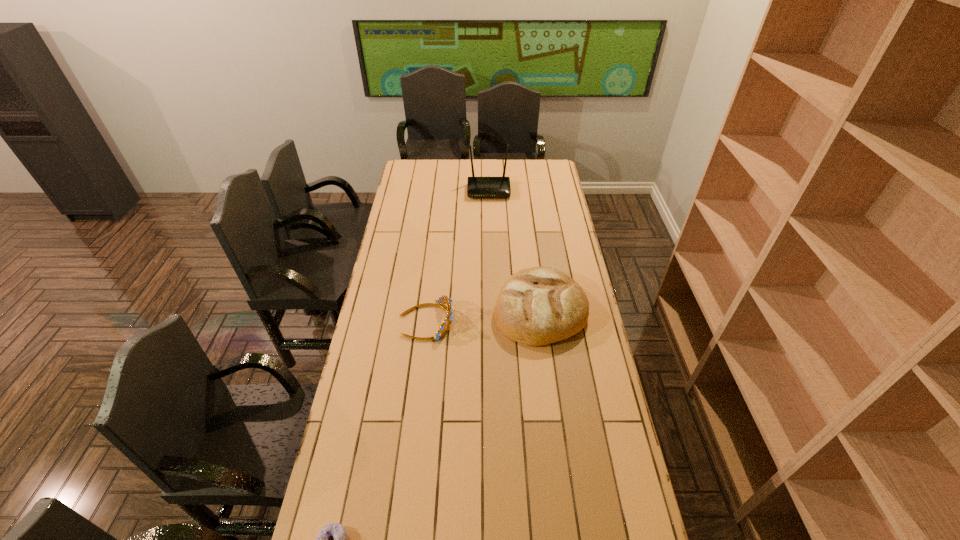
At what (x,y) coordinates should I click in order to perform the action: click on free space at the left edge of the desktop. Please return your answer as a coordinate pair (x, y). This screenshot has width=960, height=540. Looking at the image, I should click on (372, 530).

Find the location of a particular element. The image size is (960, 540). vacant space at the right edge of the desktop is located at coordinates (546, 243).

This screenshot has width=960, height=540. Identify the location of free area in between the bread and the second object from left to right. (483, 315).

Image resolution: width=960 pixels, height=540 pixels. What are the coordinates of `vacant space that's between the router and the second object from left to right` in the screenshot? It's located at (458, 256).

The height and width of the screenshot is (540, 960). In order to click on the third closest object relative to the tiara in this screenshot , I will do (x=477, y=187).

Identify which object is the closest to the tiara. Please provide its 2D coordinates. Your answer should be formatted as a tuple, i.e. [(x, y)], where the tuple contains the x and y coordinates of a point satisfying the conditions above.

[(536, 306)]

Identify the location of vacant space that satisfies the following two spatial constraints: 1. on the front-facing side of the farthest object; 2. on the right side of the bread. The height and width of the screenshot is (540, 960). (492, 309).